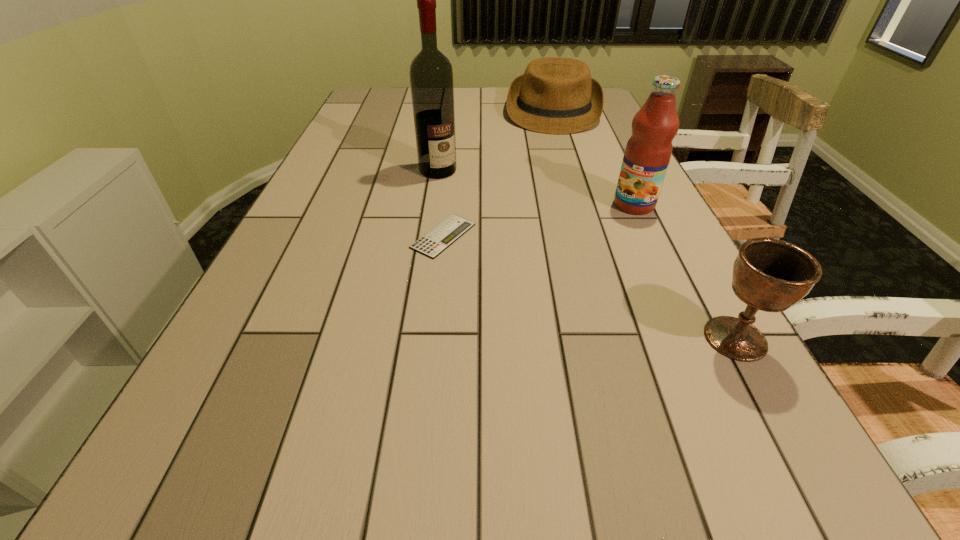
Find the location of `the shortest object`. the shortest object is located at coordinates coord(433,243).

Find the location of a particular element. the third shortest object is located at coordinates (770, 275).

Find the location of `chalice`. chalice is located at coordinates (770, 275).

This screenshot has height=540, width=960. Identify the location of alcohol. (431, 75).

Locate an element on the screen. The width and height of the screenshot is (960, 540). the tallest object is located at coordinates (431, 75).

Locate an element on the screen. This screenshot has width=960, height=540. the farthest object is located at coordinates (555, 95).

The width and height of the screenshot is (960, 540). I want to click on the second shortest object, so pos(555,95).

Identify the location of the fourth shortest object. (648, 151).

At what (x,y) coordinates should I click in order to perform the action: click on vacant point located on the back of the shortest object. Please return your answer as a coordinate pair (x, y). Looking at the image, I should click on (448, 191).

Identify the location of vacant space located on the back of the third tallest object. This screenshot has height=540, width=960. (700, 276).